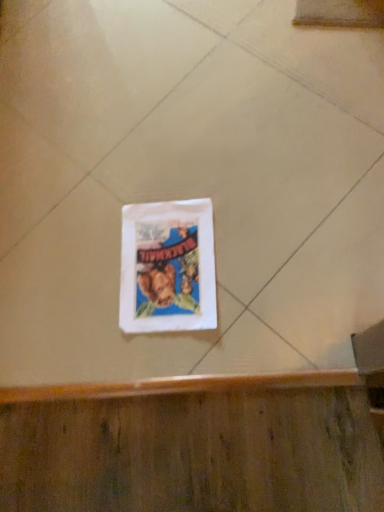
Locate an element on the screen. Image resolution: width=384 pixels, height=512 pixels. free location to the right of white paper bag at center is located at coordinates (263, 228).